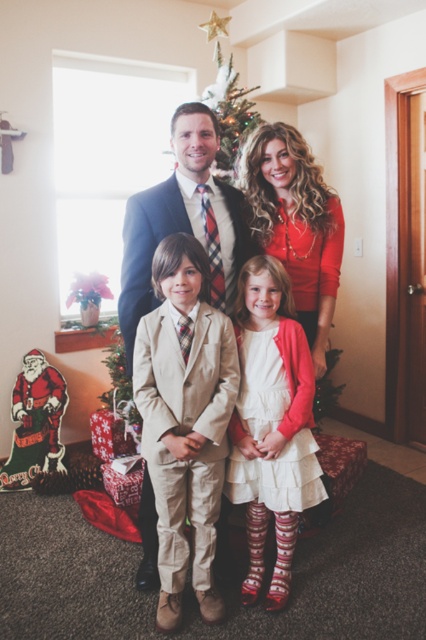
Is the position of light brown suit at center more distant than that of green matte christmas tree at center?

No, light brown suit at center is closer to the viewer.

Is point (141, 292) positioned before point (218, 115)?

Yes, it is.

Is point (160, 301) farther from viewer compared to point (233, 128)?

No, it is not.

I want to click on light brown suit at center, so click(184, 221).

Does white satin dress at center appear under light brown suit at center?

Indeed, white satin dress at center is positioned under light brown suit at center.

Does white satin dress at center appear on the right side of light brown suit at center?

Indeed, white satin dress at center is positioned on the right side of light brown suit at center.

Find the location of a particular element. The image size is (426, 640). white satin dress at center is located at coordinates (271, 424).

Is matte red sweater at center thinner than green matte christmas tree at center?

No, matte red sweater at center is not thinner than green matte christmas tree at center.

Is point (261, 173) closer to viewer compared to point (238, 154)?

Yes.

Who is more distant from viewer, (x=273, y=195) or (x=227, y=141)?

The point (x=227, y=141) is behind.

I want to click on matte red sweater at center, so [296, 225].